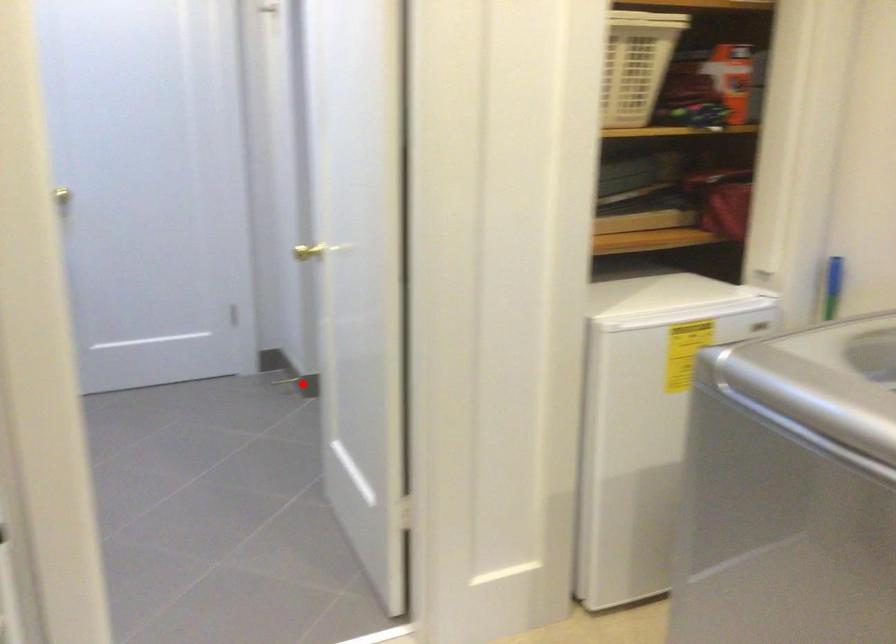
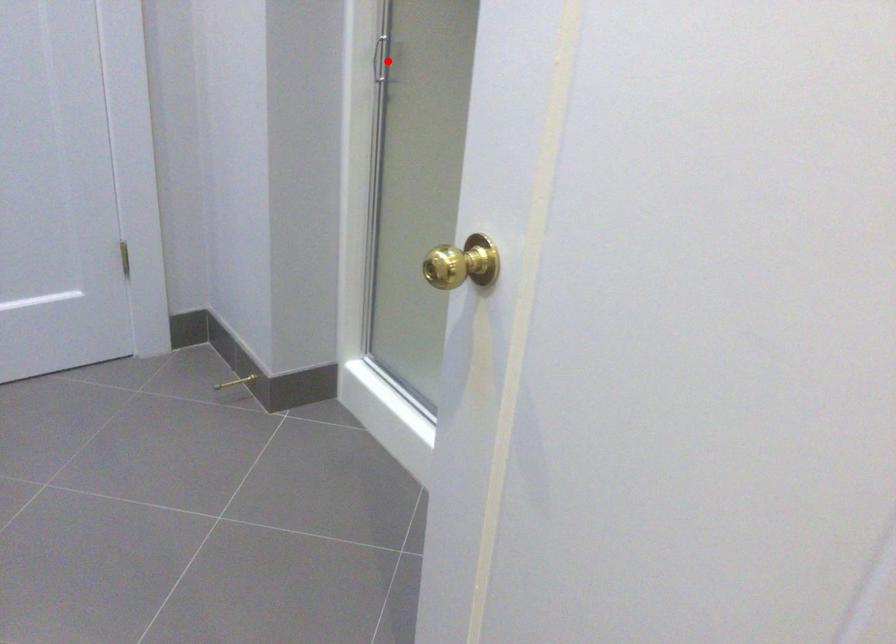
Based on the photo, I am providing you with two images of the same scene from different viewpoints. A red point is marked on the first image and another point is marked on the second image. Is the marked point in image1 the same physical position as the marked point in image2?

No